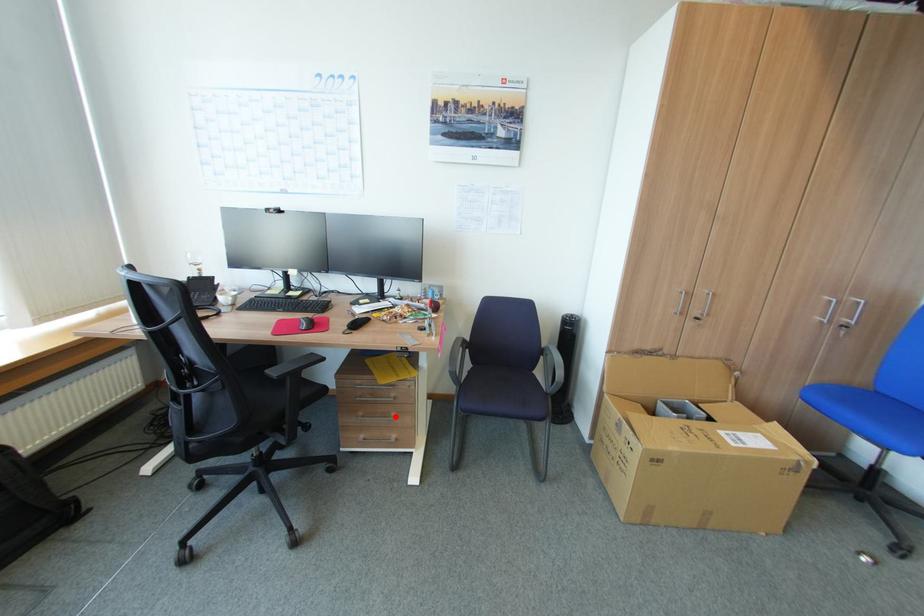
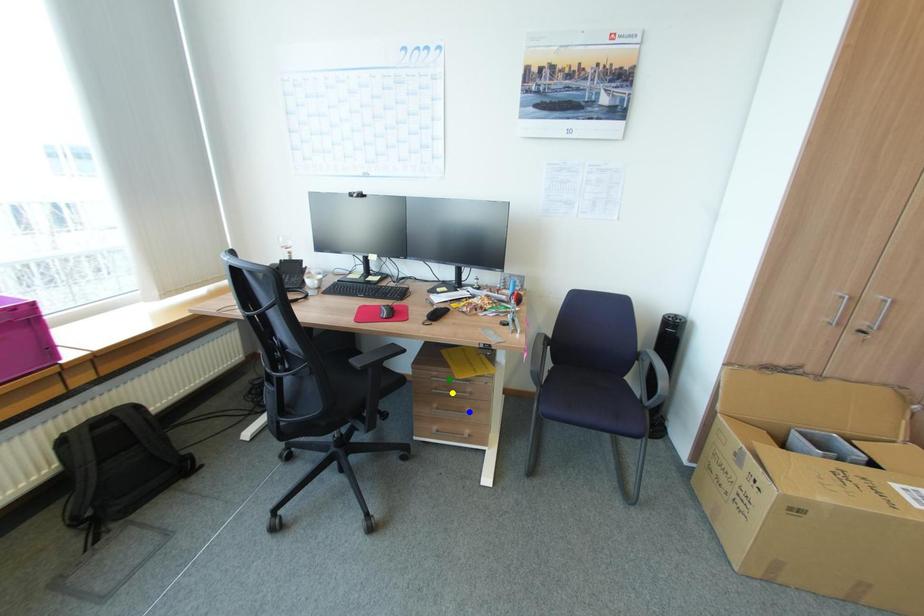
Question: I am providing you with two images of the same scene from different viewpoints. A red point is marked on the first image. You are given multiple points on the second image. In image 2, which mark is for the same physical point as the one in image 1?

Choices:
 (A) yellow point
 (B) green point
 (C) blue point

Answer: (C)